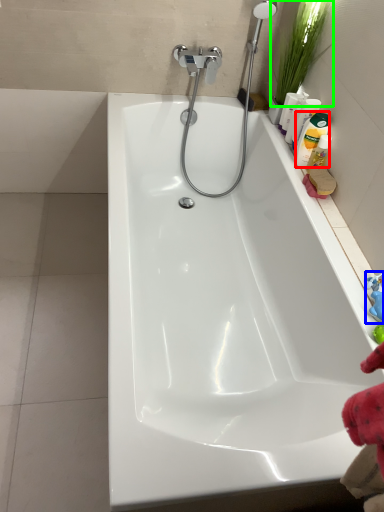
Question: Which object is the farthest from cleaning product (highlighted by a red box)? Choose among these: toy (highlighted by a blue box) or plant (highlighted by a green box).

Choices:
 (A) toy
 (B) plant

Answer: (A)